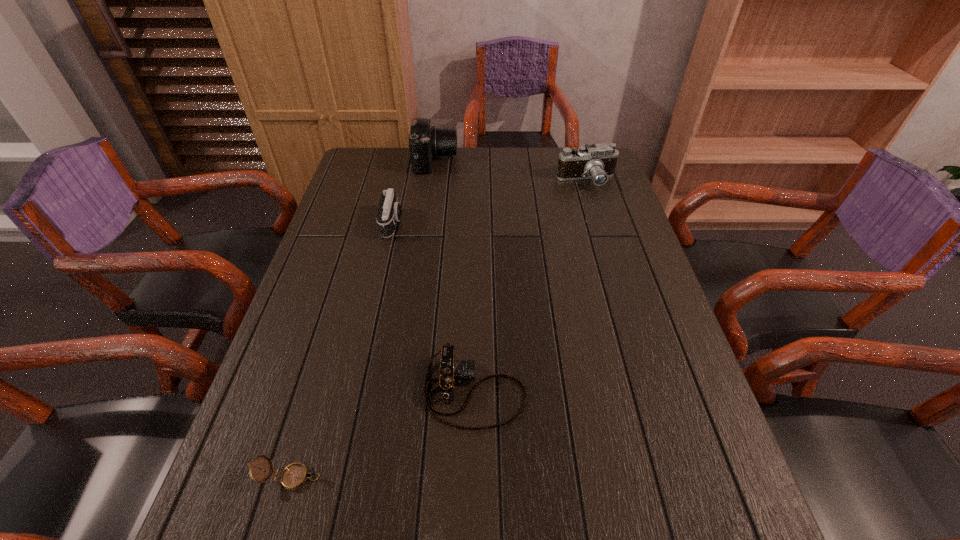
Choose which object is the nearest neighbor to the rightmost object. Please provide its 2D coordinates. Your answer should be formatted as a tuple, i.e. [(x, y)], where the tuple contains the x and y coordinates of a point satisfying the conditions above.

[(426, 142)]

Select which camera appears as the third closest to the shortest camera. Please provide its 2D coordinates. Your answer should be formatted as a tuple, i.e. [(x, y)], where the tuple contains the x and y coordinates of a point satisfying the conditions above.

[(426, 142)]

Select which camera appears as the fourth closest to the nearest object. Please provide its 2D coordinates. Your answer should be formatted as a tuple, i.e. [(x, y)], where the tuple contains the x and y coordinates of a point satisfying the conditions above.

[(597, 162)]

I want to click on free location that satisfies the following two spatial constraints: 1. at the lens of the rightmost object; 2. on the face of the compass, so click(678, 477).